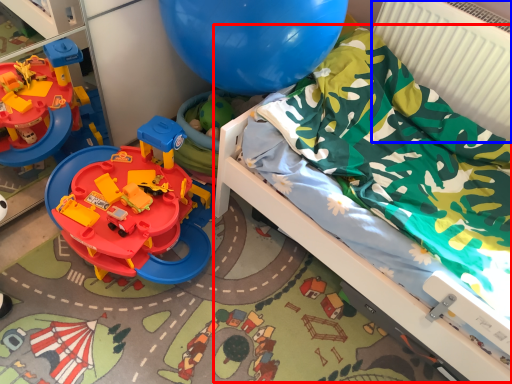
Question: Which of the following is the closest to the observer, bed (highlighted by a red box) or radiator (highlighted by a blue box)?

Choices:
 (A) bed
 (B) radiator

Answer: (A)